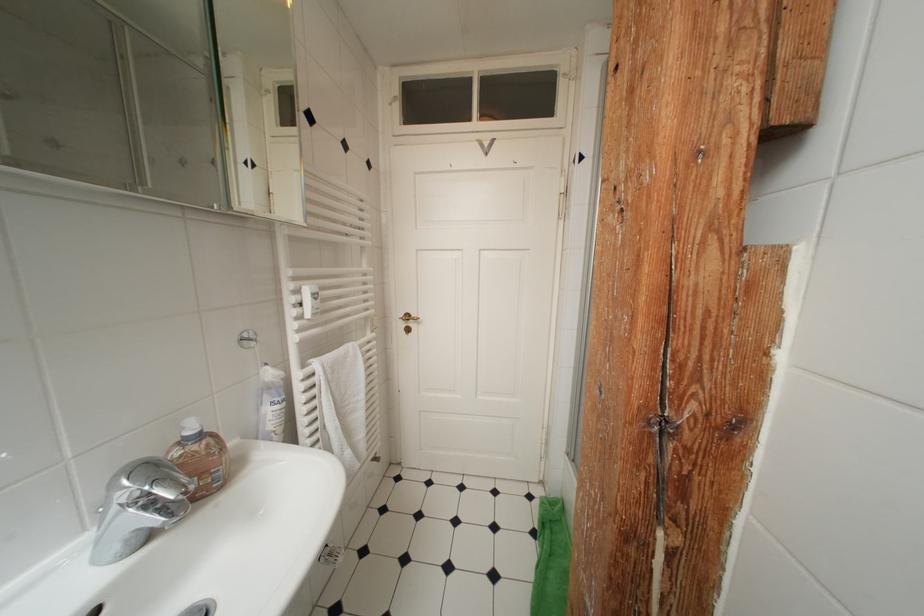
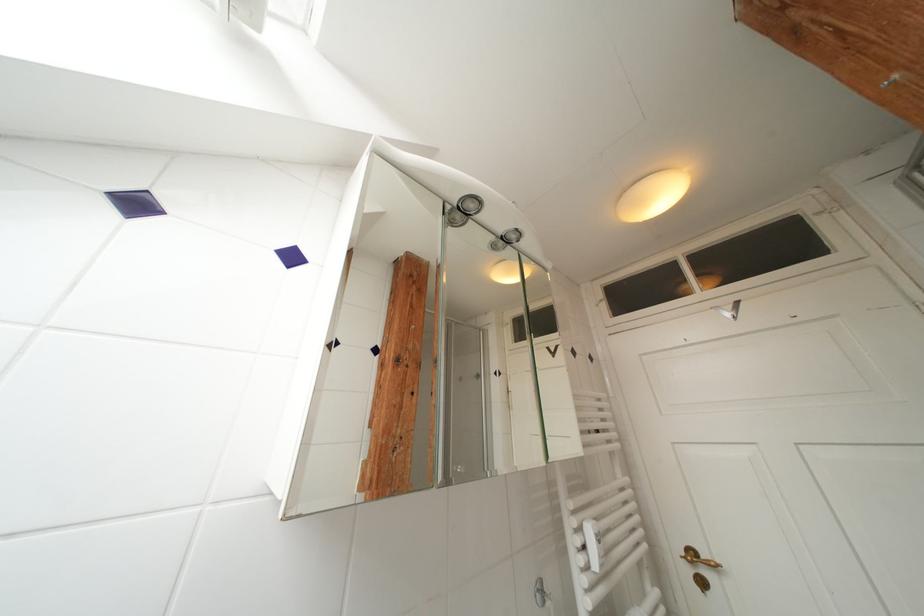
Locate, in the second image, the point that corresponds to the point at 415,320 in the first image.

(699, 557)